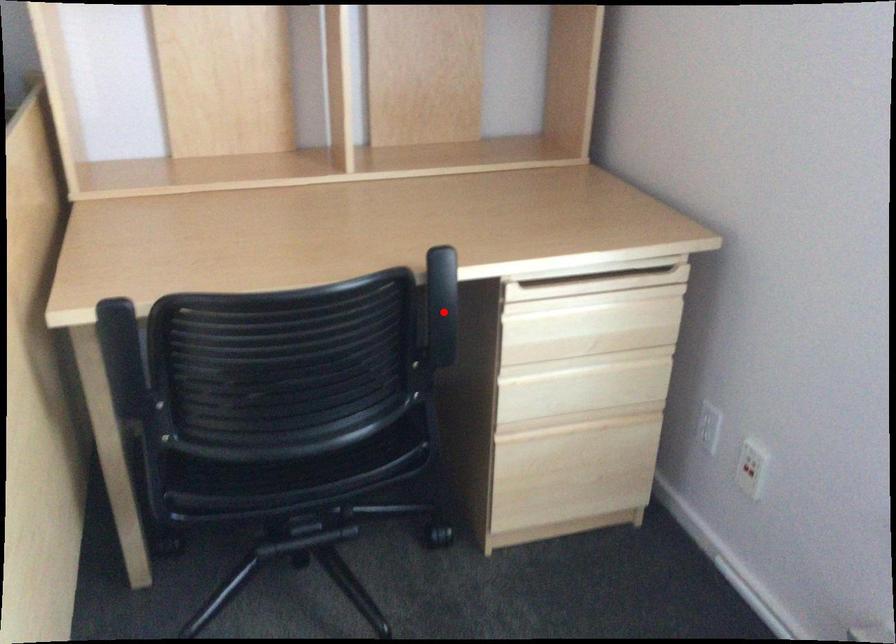
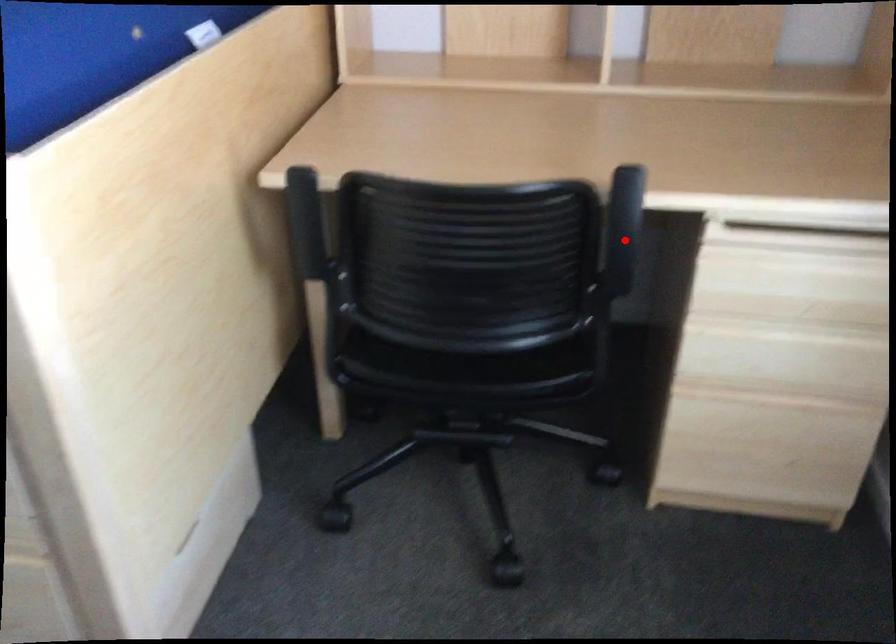
I am providing you with two images of the same scene from different viewpoints. A red point is marked on the first image and another point is marked on the second image. Is the marked point in image1 the same physical position as the marked point in image2?

Yes